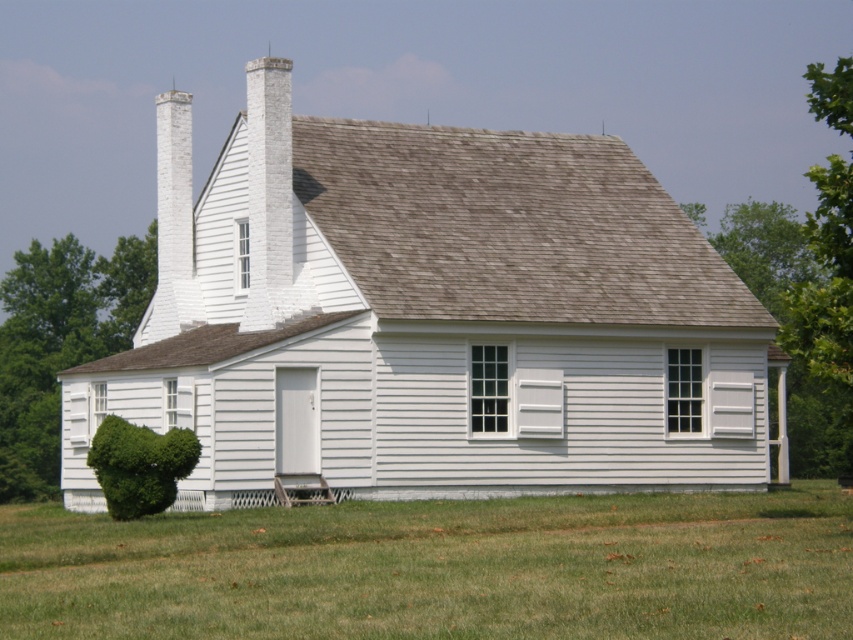
Question: Is green grass at lower center wider than green leafy bush at lower left?

Choices:
 (A) yes
 (B) no

Answer: (A)

Question: Does green grass at lower center have a lesser width compared to green leafy bush at lower left?

Choices:
 (A) no
 (B) yes

Answer: (A)

Question: Which point appears farthest from the camera in this image?

Choices:
 (A) [44, 493]
 (B) [384, 630]

Answer: (A)

Question: Is green grass at lower center to the right of green leafy bush at lower left from the viewer's perspective?

Choices:
 (A) no
 (B) yes

Answer: (B)

Question: Which point is farther to the camera?

Choices:
 (A) (61, 257)
 (B) (585, 525)

Answer: (A)